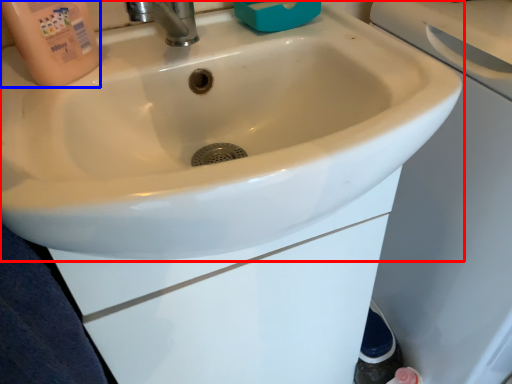
Question: Which object is further to the camera taking this photo, sink (highlighted by a red box) or cleaning product (highlighted by a blue box)?

Choices:
 (A) sink
 (B) cleaning product

Answer: (B)